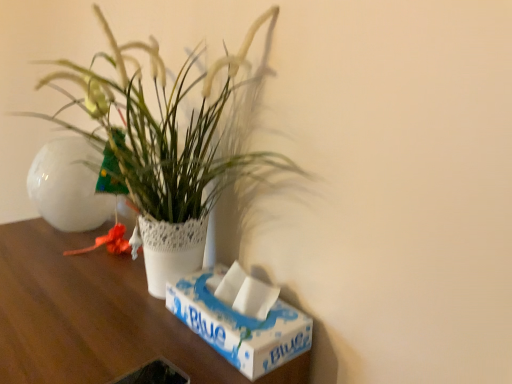
Question: Is white cardboard box at lower right in contact with wooden table at center?

Choices:
 (A) no
 (B) yes

Answer: (A)

Question: Considering the relative sizes of white cardboard box at lower right and wooden table at center in the image provided, is white cardboard box at lower right taller than wooden table at center?

Choices:
 (A) yes
 (B) no

Answer: (B)

Question: From a real-world perspective, does white cardboard box at lower right sit lower than wooden table at center?

Choices:
 (A) yes
 (B) no

Answer: (B)

Question: Is white cardboard box at lower right looking in the opposite direction of wooden table at center?

Choices:
 (A) no
 (B) yes

Answer: (A)

Question: Is white cardboard box at lower right shorter than wooden table at center?

Choices:
 (A) no
 (B) yes

Answer: (B)

Question: From a real-world perspective, is white cardboard box at lower right over wooden table at center?

Choices:
 (A) no
 (B) yes

Answer: (B)

Question: From a real-world perspective, is white lace pot at center under white glossy flowerpot at left?

Choices:
 (A) no
 (B) yes

Answer: (A)

Question: Is white lace pot at center thinner than white glossy flowerpot at left?

Choices:
 (A) yes
 (B) no

Answer: (A)

Question: Is there a large distance between white lace pot at center and white glossy flowerpot at left?

Choices:
 (A) yes
 (B) no

Answer: (B)

Question: From a real-world perspective, does white lace pot at center stand above white glossy flowerpot at left?

Choices:
 (A) yes
 (B) no

Answer: (A)

Question: Is white lace pot at center to the right of white glossy flowerpot at left from the viewer's perspective?

Choices:
 (A) no
 (B) yes

Answer: (B)

Question: Considering the relative sizes of white lace pot at center and white glossy flowerpot at left in the image provided, is white lace pot at center wider than white glossy flowerpot at left?

Choices:
 (A) no
 (B) yes

Answer: (A)

Question: From the image's perspective, is white lace pot at center beneath wooden table at center?

Choices:
 (A) yes
 (B) no

Answer: (B)